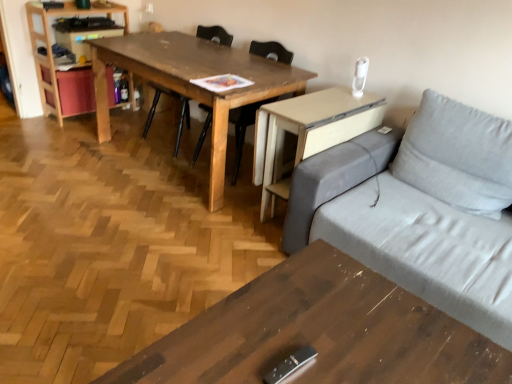
Image resolution: width=512 pixels, height=384 pixels. In order to click on vacant space situated on the left part of beige wood computer desk at right in this screenshot , I will do `click(221, 215)`.